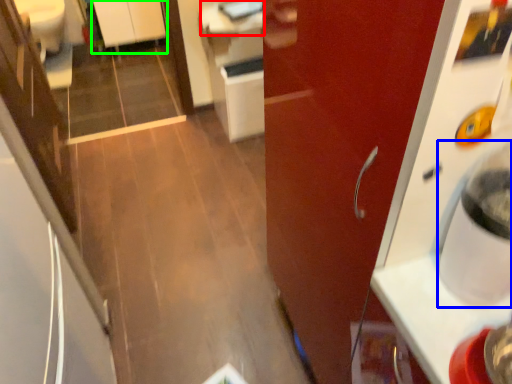
Question: Considering the real-world distances, which object is closest to counter top (highlighted by a red box)? water cooler (highlighted by a blue box) or cabinetry (highlighted by a green box).

Choices:
 (A) water cooler
 (B) cabinetry

Answer: (B)